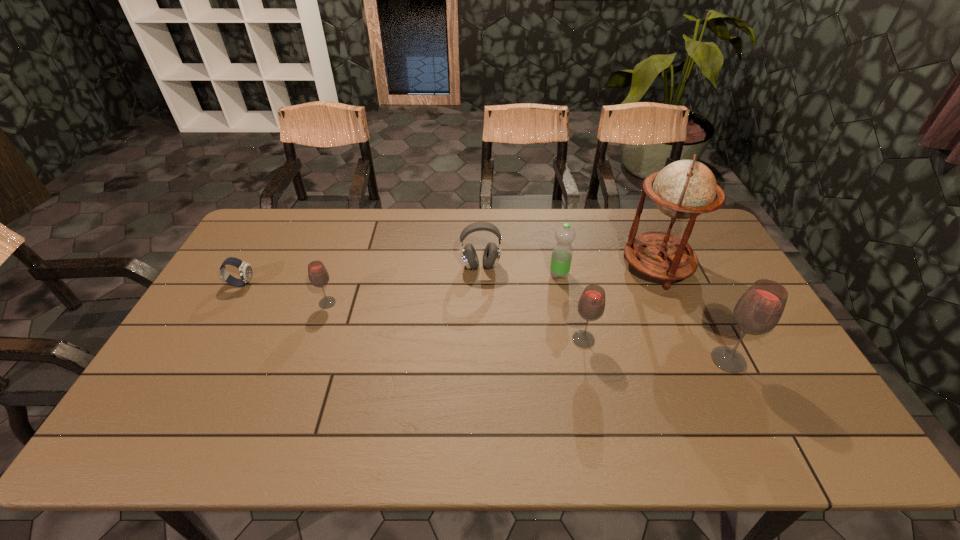
In order to click on free spot between the second tallest object and the watch in this screenshot , I will do `click(485, 322)`.

Identify the location of empty location between the watch and the shortest glass drink container. The width and height of the screenshot is (960, 540). (284, 293).

Locate an element on the screen. The height and width of the screenshot is (540, 960). vacant space in between the second glass drink container from left to right and the farthest glass drink container is located at coordinates (455, 321).

This screenshot has height=540, width=960. Find the location of `empty space between the second glass drink container from right to left and the shortest object`. empty space between the second glass drink container from right to left and the shortest object is located at coordinates (413, 312).

The height and width of the screenshot is (540, 960). Identify the location of unoccupied position between the shortest glass drink container and the second glass drink container from right to left. (455, 321).

This screenshot has width=960, height=540. What are the coordinates of `free space that is in between the water bottle and the second shortest glass drink container` in the screenshot? It's located at (571, 307).

The image size is (960, 540). What are the coordinates of `empty space that is in between the rightmost glass drink container and the tallest object` in the screenshot? It's located at (692, 314).

At what (x,y) coordinates should I click in order to perform the action: click on free space between the second shortest glass drink container and the fifth object from right to left. Please return your answer as a coordinate pair (x, y). This screenshot has width=960, height=540. Looking at the image, I should click on (532, 303).

This screenshot has width=960, height=540. I want to click on object that stands as the closest to the shortest object, so click(x=318, y=275).

Choose which object is the sixth nearest neighbor to the fifth object from right to left. Please provide its 2D coordinates. Your answer should be formatted as a tuple, i.e. [(x, y)], where the tuple contains the x and y coordinates of a point satisfying the conditions above.

[(245, 270)]